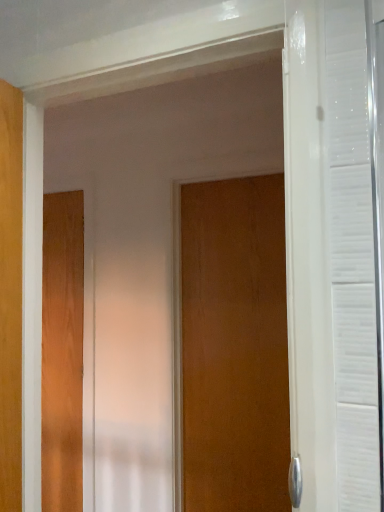
Question: From a real-world perspective, is wooden door at center, arranged as the 1th door when viewed from the front, positioned above or below wooden door at left, the first door viewed from the left?

Choices:
 (A) above
 (B) below

Answer: (A)

Question: Based on their sizes in the image, would you say wooden door at center, positioned as the 2th door in back-to-front order, is bigger or smaller than wooden door at left, the second door when ordered from right to left?

Choices:
 (A) small
 (B) big

Answer: (B)

Question: Considering the positions of wooden door at center, arranged as the 1th door when viewed from the front, and wooden door at left, the second door when ordered from right to left, in the image, is wooden door at center, arranged as the 1th door when viewed from the front, taller or shorter than wooden door at left, the second door when ordered from right to left,?

Choices:
 (A) short
 (B) tall

Answer: (A)

Question: Looking at the image, does wooden door at left, which appears as the first door when viewed from the back, seem bigger or smaller compared to wooden door at center, arranged as the 1th door when viewed from the front?

Choices:
 (A) big
 (B) small

Answer: (B)

Question: In the image, is wooden door at left, acting as the 2th door starting from the front, positioned in front of or behind wooden door at center, positioned as the second door in left-to-right order?

Choices:
 (A) front
 (B) behind

Answer: (B)

Question: From a real-world perspective, is wooden door at left, acting as the 2th door starting from the front, positioned above or below wooden door at center, positioned as the 2th door in back-to-front order?

Choices:
 (A) below
 (B) above

Answer: (A)

Question: From the image's perspective, relative to wooden door at center, marked as the 1th door in a right-to-left arrangement, is wooden door at left, the first door viewed from the left, above or below?

Choices:
 (A) below
 (B) above

Answer: (A)